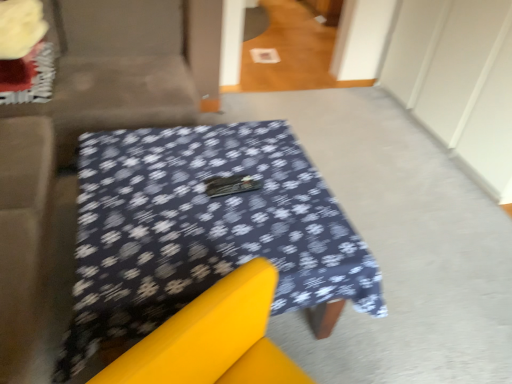
Question: Based on their sizes in the image, would you say dark blue fabric-covered table at center is bigger or smaller than fluffy yellow flower at upper left?

Choices:
 (A) big
 (B) small

Answer: (A)

Question: From the image's perspective, is dark blue fabric-covered table at center above or below fluffy yellow flower at upper left?

Choices:
 (A) below
 (B) above

Answer: (A)

Question: Which object is the farthest from the fluffy yellow flower at upper left?

Choices:
 (A) velvet beige couch at upper left
 (B) dark blue fabric-covered table at center

Answer: (B)

Question: Estimate the real-world distances between objects in this image. Which object is closer to the fluffy yellow flower at upper left?

Choices:
 (A) velvet beige couch at upper left
 (B) dark blue fabric-covered table at center

Answer: (A)